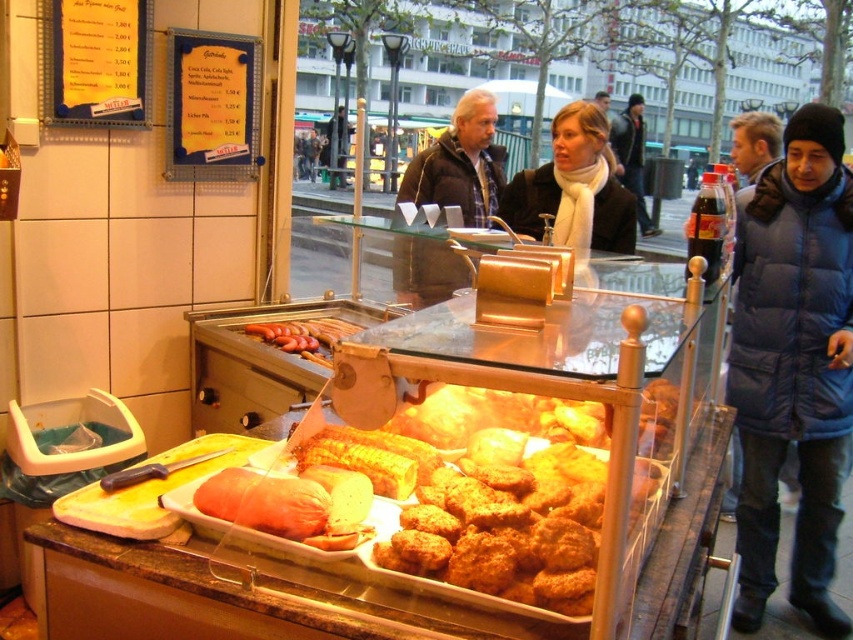
Question: Can you confirm if smooth pinkish-brown sausage at center is positioned to the left of sausagesmoothat center?

Choices:
 (A) yes
 (B) no

Answer: (B)

Question: Is matte black jacket at center to the left of sausagesmoothat center from the viewer's perspective?

Choices:
 (A) yes
 (B) no

Answer: (B)

Question: Which point is closer to the camera taking this photo?

Choices:
 (A) [328, 509]
 (B) [641, 188]

Answer: (A)

Question: Can you confirm if sausagesmoothat center is wider than dark blue puffer jacket at center?

Choices:
 (A) yes
 (B) no

Answer: (B)

Question: Which point is farther to the camera?

Choices:
 (A) matte black jacket at center
 (B) dark blue puffer jacket at right

Answer: (A)

Question: Among these points, which one is nearest to the camera?

Choices:
 (A) (401, 273)
 (B) (302, 353)
 (C) (318, 492)

Answer: (C)